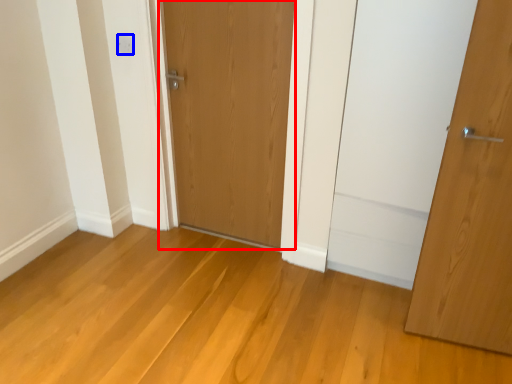
Question: Which of the following is the closest to the observer, door (highlighted by a red box) or electric outlet (highlighted by a blue box)?

Choices:
 (A) door
 (B) electric outlet

Answer: (A)